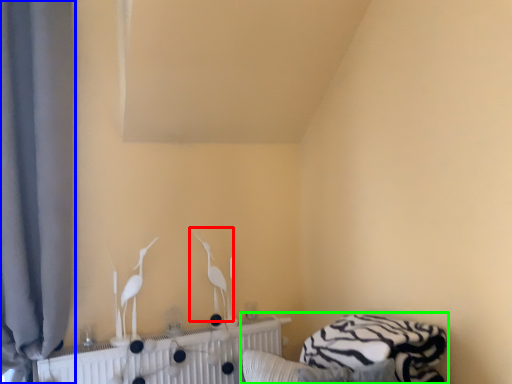
Question: Based on their relative distances, which object is nearer to bird (highlighted by a red box)? Choose from curtain (highlighted by a blue box) and bed (highlighted by a green box).

Choices:
 (A) curtain
 (B) bed

Answer: (B)